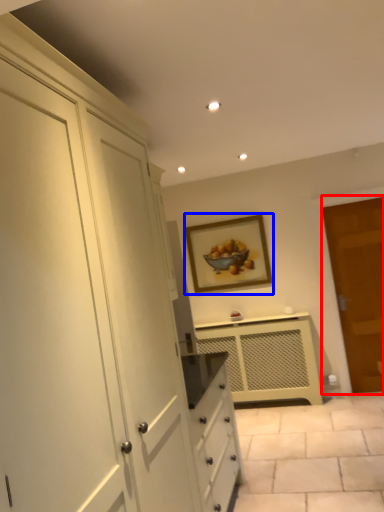
Question: Which object is closer to the camera taking this photo, door (highlighted by a red box) or picture frame (highlighted by a blue box)?

Choices:
 (A) door
 (B) picture frame

Answer: (A)